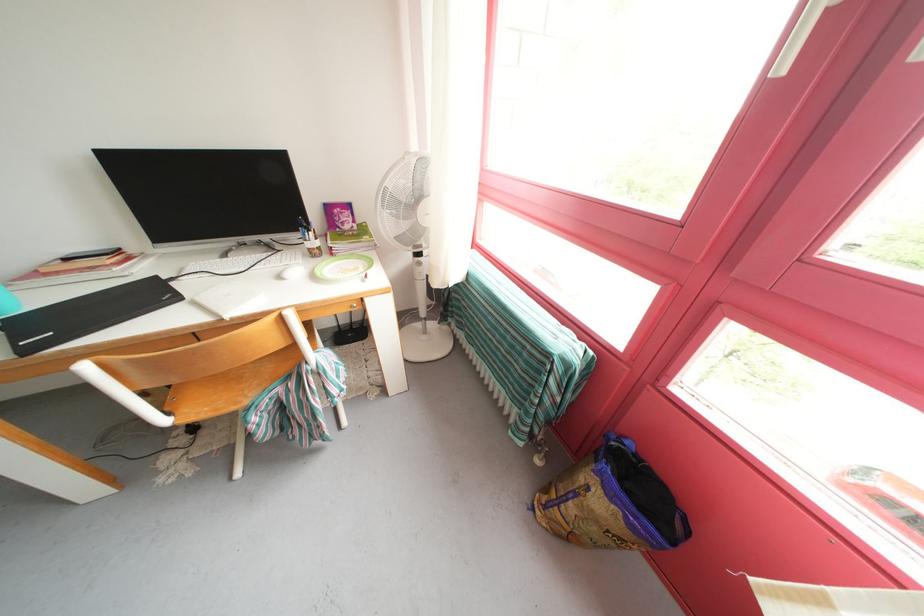
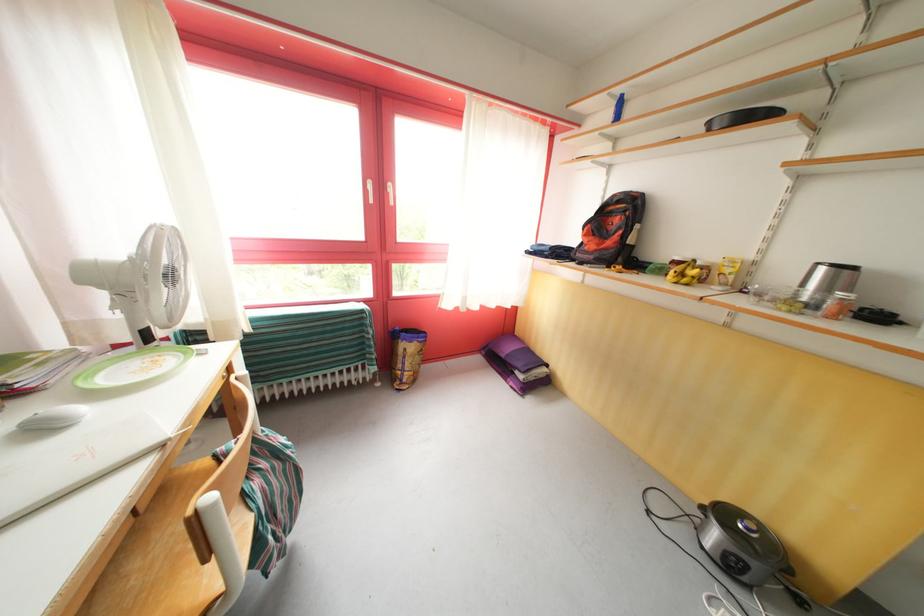
The point at (368,262) is marked in the first image. Where is the corresponding point in the second image?

(128, 363)